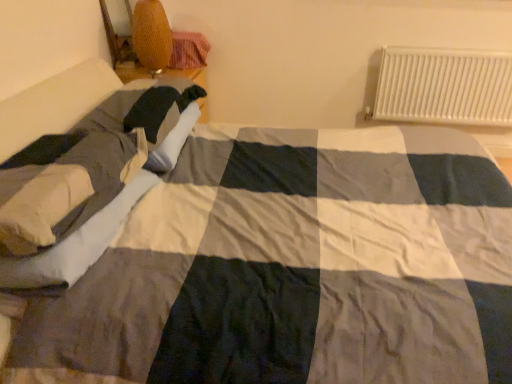
In order to click on woven wicker lampshade at upper left in this screenshot , I will do `click(151, 36)`.

In order to face soft beige pillow at left, should I rotate leftwards or rightwards?

You should look left and rotate roughly 25.579 degrees.

Where is `white metal radiator at upper right`? white metal radiator at upper right is located at coordinates (444, 86).

The width and height of the screenshot is (512, 384). What do you see at coordinates (444, 86) in the screenshot? I see `white metal radiator at upper right` at bounding box center [444, 86].

What are the coordinates of `woven wicker lampshade at upper left` in the screenshot? It's located at (151, 36).

From a real-world perspective, between white metal radiator at upper right and woven wicker lampshade at upper left, who is vertically lower?

white metal radiator at upper right is physically lower.

Is white metal radiator at upper right placed right next to woven wicker lampshade at upper left?

There is a gap between white metal radiator at upper right and woven wicker lampshade at upper left.

Which of these two, white metal radiator at upper right or woven wicker lampshade at upper left, is bigger?

white metal radiator at upper right.

Can you tell me how much white metal radiator at upper right and soft beige pillow at left differ in facing direction?

The facing directions of white metal radiator at upper right and soft beige pillow at left are 90 degrees apart.

From the picture: Is white metal radiator at upper right in contact with soft beige pillow at left?

white metal radiator at upper right is not next to soft beige pillow at left, and they're not touching.

Would you say white metal radiator at upper right is to the left or to the right of soft beige pillow at left in the picture?

white metal radiator at upper right is to the right of soft beige pillow at left.

Is woven wicker lampshade at upper left wider or thinner than white metal radiator at upper right?

In the image, woven wicker lampshade at upper left appears to be wider than white metal radiator at upper right.

Can we say woven wicker lampshade at upper left lies outside white metal radiator at upper right?

woven wicker lampshade at upper left is positioned outside white metal radiator at upper right.

From the image's perspective, is woven wicker lampshade at upper left located above or below white metal radiator at upper right?

From the image's perspective, woven wicker lampshade at upper left appears above white metal radiator at upper right.

Considering the positions of points (161, 43) and (430, 68), is point (161, 43) farther from camera compared to point (430, 68)?

No, it is in front of (430, 68).

Which is more to the right, woven wicker lampshade at upper left or soft beige pillow at left?

From the viewer's perspective, woven wicker lampshade at upper left appears more on the right side.

From a real-world perspective, is woven wicker lampshade at upper left physically located above or below soft beige pillow at left?

woven wicker lampshade at upper left is above soft beige pillow at left.

This screenshot has width=512, height=384. What are the coordinates of `person in front of the woven wicker lampshade at upper left` in the screenshot? It's located at (83, 162).

Considering the relative positions of woven wicker lampshade at upper left and soft beige pillow at left in the image provided, is woven wicker lampshade at upper left behind soft beige pillow at left?

That is True.

Is soft beige pillow at left in front of woven wicker lampshade at upper left?

Yes, it is in front of woven wicker lampshade at upper left.

From the image's perspective, which one is positioned higher, soft beige pillow at left or woven wicker lampshade at upper left?

woven wicker lampshade at upper left appears higher in the image.

Considering the relative sizes of soft beige pillow at left and woven wicker lampshade at upper left in the image provided, is soft beige pillow at left thinner than woven wicker lampshade at upper left?

Incorrect, the width of soft beige pillow at left is not less than that of woven wicker lampshade at upper left.

From the image's perspective, which one is positioned lower, soft beige pillow at left or white metal radiator at upper right?

soft beige pillow at left is shown below in the image.

Which object is positioned more to the right, soft beige pillow at left or white metal radiator at upper right?

white metal radiator at upper right.

In terms of size, does soft beige pillow at left appear bigger or smaller than white metal radiator at upper right?

Clearly, soft beige pillow at left is larger in size than white metal radiator at upper right.

Considering the positions of objects soft beige pillow at left and white metal radiator at upper right in the image provided, who is in front, soft beige pillow at left or white metal radiator at upper right?

soft beige pillow at left is more forward.

Locate an element on the screen. This screenshot has width=512, height=384. lamp positioned vertically above the white metal radiator at upper right (from a real-world perspective) is located at coordinates (151, 36).

Where is `person below the white metal radiator at upper right (from the image's perspective)`? person below the white metal radiator at upper right (from the image's perspective) is located at coordinates (83, 162).

When comparing their distances from woven wicker lampshade at upper left, does white metal radiator at upper right or soft beige pillow at left seem closer?

soft beige pillow at left is positioned closer to the anchor woven wicker lampshade at upper left.

Considering their positions, is white metal radiator at upper right positioned further to soft beige pillow at left than woven wicker lampshade at upper left?

white metal radiator at upper right is further to soft beige pillow at left.

Estimate the real-world distances between objects in this image. Which object is further from soft beige pillow at left, woven wicker lampshade at upper left or white metal radiator at upper right?

white metal radiator at upper right lies further to soft beige pillow at left than the other object.

When comparing their distances from woven wicker lampshade at upper left, does soft beige pillow at left or white metal radiator at upper right seem closer?

soft beige pillow at left.

Estimate the real-world distances between objects in this image. Which object is further from white metal radiator at upper right, woven wicker lampshade at upper left or soft beige pillow at left?

Based on the image, soft beige pillow at left appears to be further to white metal radiator at upper right.

Looking at the image, which one is located closer to white metal radiator at upper right, soft beige pillow at left or woven wicker lampshade at upper left?

woven wicker lampshade at upper left is positioned closer to the anchor white metal radiator at upper right.

I want to click on lamp located between soft beige pillow at left and white metal radiator at upper right in the left-right direction, so click(x=151, y=36).